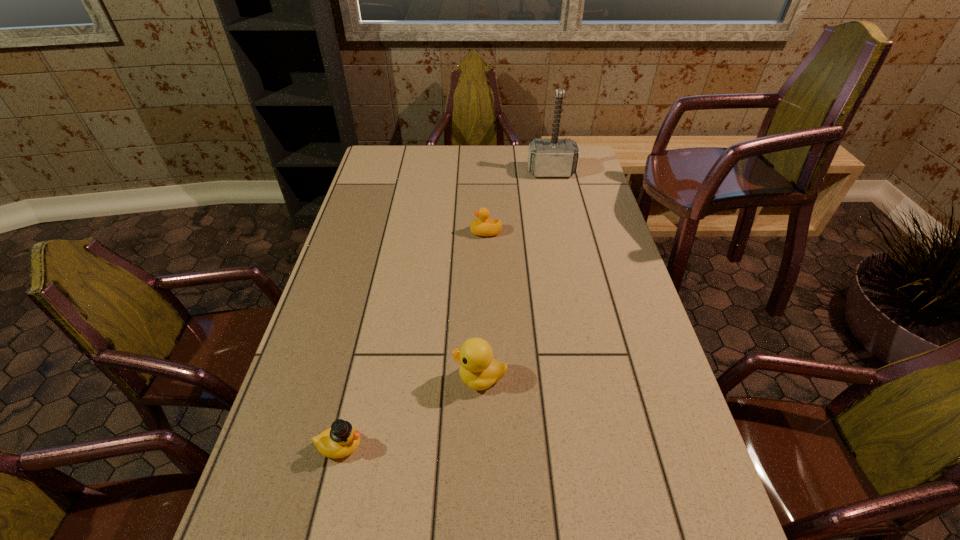
The image size is (960, 540). Identify the location of vacant space that is in between the second farthest object and the leftmost object. (413, 339).

Where is `unoccupied position between the nearest duck and the hammer`? This screenshot has height=540, width=960. unoccupied position between the nearest duck and the hammer is located at coordinates (445, 309).

Where is `the closest object to the leftmost object`? the closest object to the leftmost object is located at coordinates (478, 369).

Where is `object that is the second closest one to the leftmost object`? The image size is (960, 540). object that is the second closest one to the leftmost object is located at coordinates (483, 225).

Where is `the second closest duck relative to the tallest duck`? The image size is (960, 540). the second closest duck relative to the tallest duck is located at coordinates (483, 225).

Point out which duck is positioned as the nearest to the second nearest duck. Please provide its 2D coordinates. Your answer should be formatted as a tuple, i.e. [(x, y)], where the tuple contains the x and y coordinates of a point satisfying the conditions above.

[(340, 440)]

I want to click on vacant position in the image that satisfies the following two spatial constraints: 1. for striking with the head of the rightmost object; 2. on the face of the second nearest object, so click(x=596, y=377).

This screenshot has width=960, height=540. I want to click on vacant space that satisfies the following two spatial constraints: 1. for striking with the head of the farthest object; 2. on the face of the farthest duck, so click(x=564, y=232).

In order to click on free space that satisfies the following two spatial constraints: 1. for striking with the head of the farthest object; 2. on the face of the farthest duck in this screenshot , I will do `click(564, 232)`.

Where is `free space that satisfies the following two spatial constraints: 1. for striking with the head of the rightmost object; 2. on the front-facing side of the nearest object`? free space that satisfies the following two spatial constraints: 1. for striking with the head of the rightmost object; 2. on the front-facing side of the nearest object is located at coordinates pos(612,446).